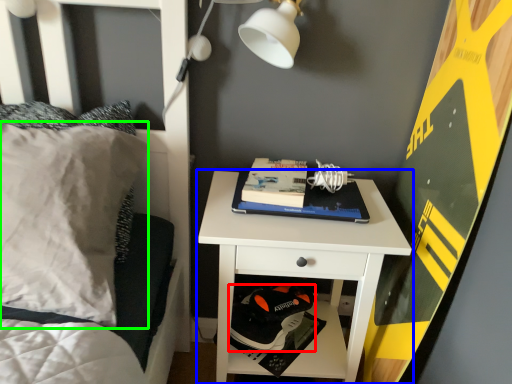
Question: Which object is the closest to the shoe (highlighted by a red box)? Choose among these: nightstand (highlighted by a blue box) or pillow (highlighted by a green box).

Choices:
 (A) nightstand
 (B) pillow

Answer: (A)